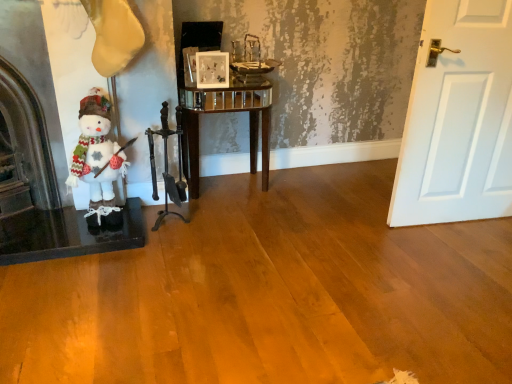
Question: Considering the positions of dark brown polished wood fireplace tools at center and dark brown stone fireplace at left in the image, is dark brown polished wood fireplace tools at center taller or shorter than dark brown stone fireplace at left?

Choices:
 (A) short
 (B) tall

Answer: (A)

Question: Does point (165, 109) appear closer or farther from the camera than point (7, 183)?

Choices:
 (A) closer
 (B) farther

Answer: (B)

Question: Which of these objects is positioned closest to the dark brown stone fireplace at left?

Choices:
 (A) dark brown polished wood fireplace tools at center
 (B) glossy wood side table at center
 (C) matte glass picture frame at center
 (D) white fabric snowman at left

Answer: (D)

Question: Which is farther from the matte glass picture frame at center?

Choices:
 (A) glossy wood side table at center
 (B) dark brown polished wood fireplace tools at center
 (C) white fabric snowman at left
 (D) dark brown stone fireplace at left

Answer: (D)